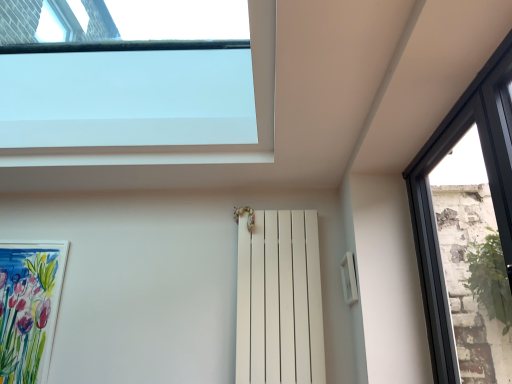
Question: Is white matte radiator at center directly adjacent to watercolor paper picture frame at lower left?

Choices:
 (A) no
 (B) yes

Answer: (A)

Question: From the image's perspective, is white matte radiator at center located beneath watercolor paper picture frame at lower left?

Choices:
 (A) yes
 (B) no

Answer: (B)

Question: Would you say white matte radiator at center contains watercolor paper picture frame at lower left?

Choices:
 (A) yes
 (B) no

Answer: (B)

Question: From a real-world perspective, does white matte radiator at center sit lower than watercolor paper picture frame at lower left?

Choices:
 (A) yes
 (B) no

Answer: (B)

Question: Would you say white matte radiator at center is outside watercolor paper picture frame at lower left?

Choices:
 (A) yes
 (B) no

Answer: (A)

Question: Is white matte radiator at center bigger or smaller than transparent glass window at upper center, which is counted as the 1th window, starting from the left?

Choices:
 (A) small
 (B) big

Answer: (A)

Question: From the image's perspective, relative to transparent glass window at upper center, the second window in the right-to-left sequence, is white matte radiator at center above or below?

Choices:
 (A) above
 (B) below

Answer: (B)

Question: Would you say white matte radiator at center is to the left or to the right of transparent glass window at upper center, the second window in the right-to-left sequence, in the picture?

Choices:
 (A) right
 (B) left

Answer: (A)

Question: From their relative heights in the image, would you say white matte radiator at center is taller or shorter than transparent glass window at upper center, which is counted as the 1th window, starting from the left?

Choices:
 (A) short
 (B) tall

Answer: (B)

Question: Considering their positions, is watercolor paper picture frame at lower left located in front of or behind transparent glass window at upper center, which is counted as the 1th window, starting from the left?

Choices:
 (A) front
 (B) behind

Answer: (B)

Question: Is watercolor paper picture frame at lower left to the left or to the right of transparent glass window at upper center, which is counted as the 1th window, starting from the left, in the image?

Choices:
 (A) right
 (B) left

Answer: (B)

Question: From a real-world perspective, is watercolor paper picture frame at lower left above or below transparent glass window at upper center, which is counted as the 1th window, starting from the left?

Choices:
 (A) above
 (B) below

Answer: (B)

Question: Considering the positions of point (3, 249) and point (151, 155), is point (3, 249) closer or farther from the camera than point (151, 155)?

Choices:
 (A) closer
 (B) farther

Answer: (B)

Question: Considering the positions of transparent glass window at upper center, which is counted as the 1th window, starting from the left, and black glass window at right, marked as the 2th window in a left-to-right arrangement, in the image, is transparent glass window at upper center, which is counted as the 1th window, starting from the left, wider or thinner than black glass window at right, marked as the 2th window in a left-to-right arrangement,?

Choices:
 (A) thin
 (B) wide

Answer: (B)

Question: Visually, is transparent glass window at upper center, which is counted as the 1th window, starting from the left, positioned to the left or to the right of black glass window at right, which is counted as the 1th window, starting from the right?

Choices:
 (A) right
 (B) left

Answer: (B)